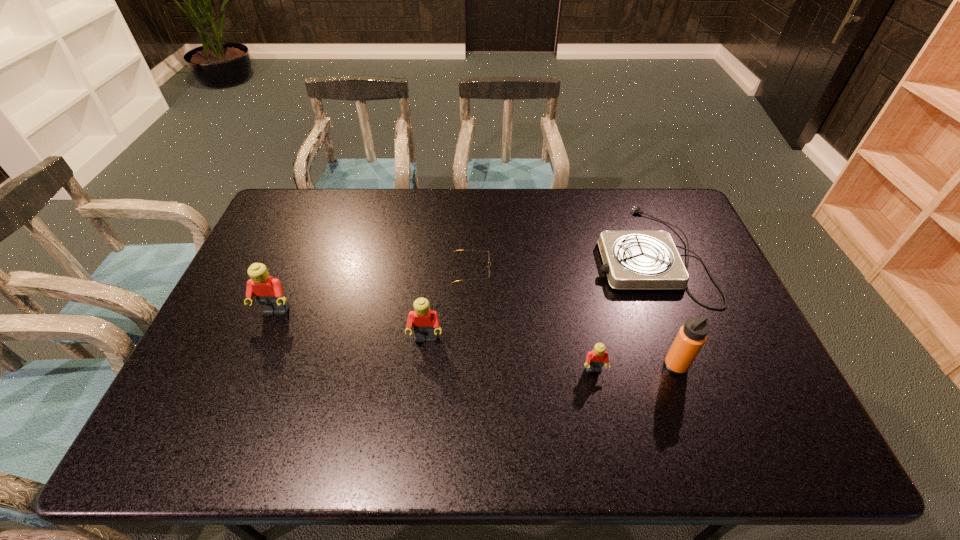
Image resolution: width=960 pixels, height=540 pixels. I want to click on vacant place for an extra Lego on the right, so click(x=783, y=404).